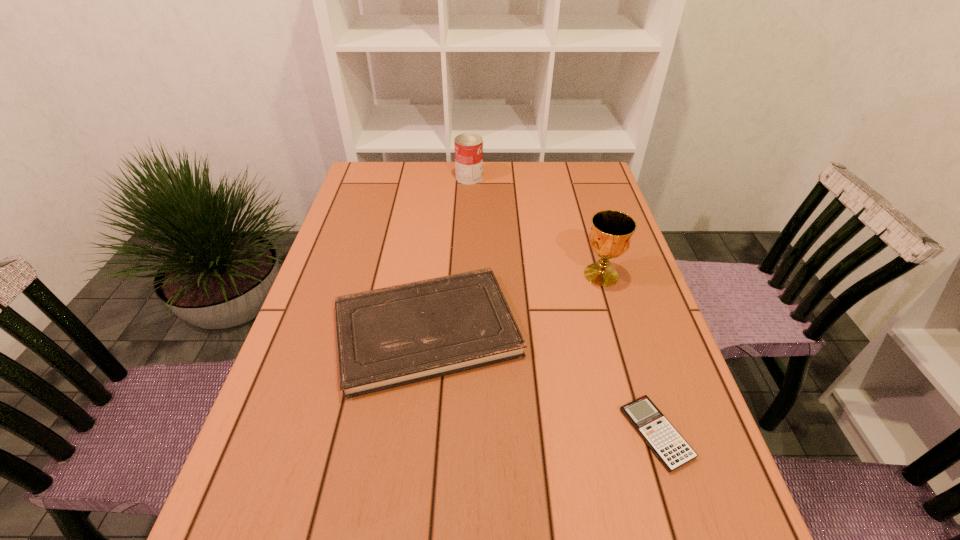
In order to click on free location that satisfies the following two spatial constraints: 1. on the front label of the chalice; 2. on the right side of the second tallest object in this screenshot , I will do `click(466, 275)`.

Locate an element on the screen. vacant space that satisfies the following two spatial constraints: 1. on the front label of the third shortest object; 2. on the left side of the chalice is located at coordinates (466, 275).

Identify the location of free region that satisfies the following two spatial constraints: 1. on the front label of the farthest object; 2. on the left side of the shortest object. The height and width of the screenshot is (540, 960). (461, 434).

The image size is (960, 540). I want to click on vacant region that satisfies the following two spatial constraints: 1. on the front label of the farthest object; 2. on the left side of the calculator, so click(x=461, y=434).

You are a GUI agent. You are given a task and a screenshot of the screen. Output one action in this format:
    pyautogui.click(x=<x>, y=<y>)
    Task: Click on the free spot that satisfies the following two spatial constraints: 1. on the front label of the calculator; 2. on the right side of the can
    The image size is (960, 540).
    Given the screenshot: What is the action you would take?
    pyautogui.click(x=461, y=434)

Identify the location of vacant position in the image that satisfies the following two spatial constraints: 1. on the front side of the tallest object; 2. on the right side of the calculator. This screenshot has height=540, width=960. (648, 434).

Image resolution: width=960 pixels, height=540 pixels. Identify the location of vacant area in the image that satisfies the following two spatial constraints: 1. on the front label of the second tallest object; 2. on the left side of the tallest object. pos(466,275).